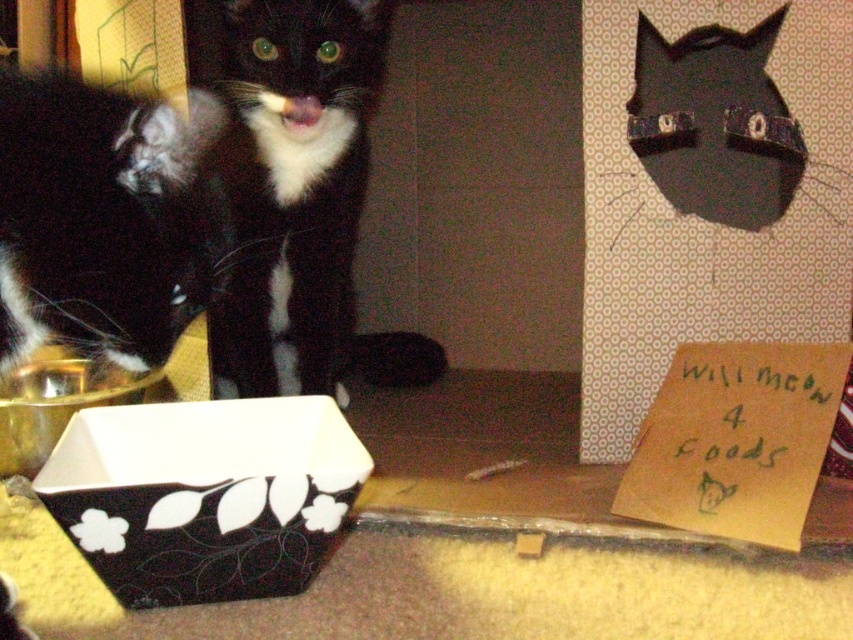
You are taking a photo of two cats and a cardboard box. You want to focus on the cat that is closer to the camera. Which point should you focus on, point (80, 337) or point (225, 472)?

Point (80, 337) is closer to the camera than point (225, 472), so you should focus on point (80, 337) to capture the cat that is closer.

What are the coordinates of the black matte fur cat at center?

The black matte fur cat at center is located at point (299, 200).

You are a cat owner who wants to ensure both cats have enough space to sit comfortably. Given that the black matte fur cat at center requires 2 square feet of space and the black fur cat at left needs 1.5 square feet, can both cats fit in a 4 square feet area?

The black matte fur cat at center requires 2 square feet and the black fur cat at left needs 1.5 square feet. Combined, they require 3.5 square feet, which is less than the 4 square feet available. Yes, both cats can fit comfortably.